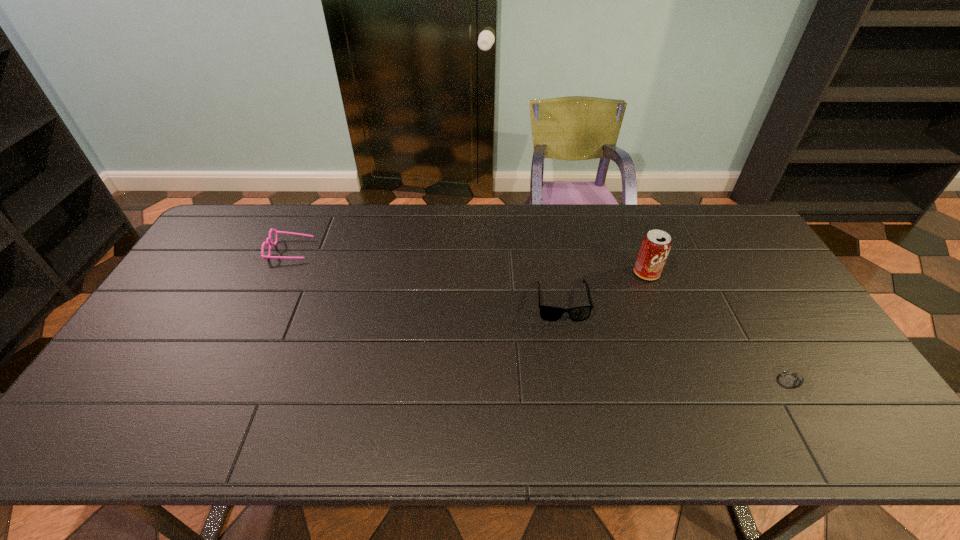
Image resolution: width=960 pixels, height=540 pixels. I want to click on vacant point located between the farthest object and the second object from left to right, so click(426, 276).

At what (x,y) coordinates should I click in order to perform the action: click on blank region between the sunglasses and the farthest object. Please return your answer as a coordinate pair (x, y). The image size is (960, 540). Looking at the image, I should click on (426, 276).

At what (x,y) coordinates should I click in order to perform the action: click on unoccupied position between the shortest object and the second object from right to left. Please return your answer as a coordinate pair (x, y). Image resolution: width=960 pixels, height=540 pixels. Looking at the image, I should click on (720, 327).

At what (x,y) coordinates should I click in order to perform the action: click on vacant space that is in between the second object from right to left and the second object from left to right. Please return your answer as a coordinate pair (x, y). This screenshot has height=540, width=960. Looking at the image, I should click on (604, 288).

Find the location of a particular element. The height and width of the screenshot is (540, 960). unoccupied position between the sunglasses and the shortest object is located at coordinates (678, 341).

At what (x,y) coordinates should I click in order to perform the action: click on vacant space that's between the third object from right to left and the leftmost object. Please return your answer as a coordinate pair (x, y). The image size is (960, 540). Looking at the image, I should click on (426, 276).

The height and width of the screenshot is (540, 960). I want to click on vacant area that lies between the second object from left to right and the tallest object, so click(x=604, y=288).

Find the location of a particular element. This screenshot has height=540, width=960. empty space that is in between the tallest object and the shortest object is located at coordinates (720, 327).

Select which object is the closest to the leftmost object. Please provide its 2D coordinates. Your answer should be formatted as a tuple, i.e. [(x, y)], where the tuple contains the x and y coordinates of a point satisfying the conditions above.

[(548, 313)]

Identify the location of the second closest object relative to the second object from left to right. The image size is (960, 540). (791, 379).